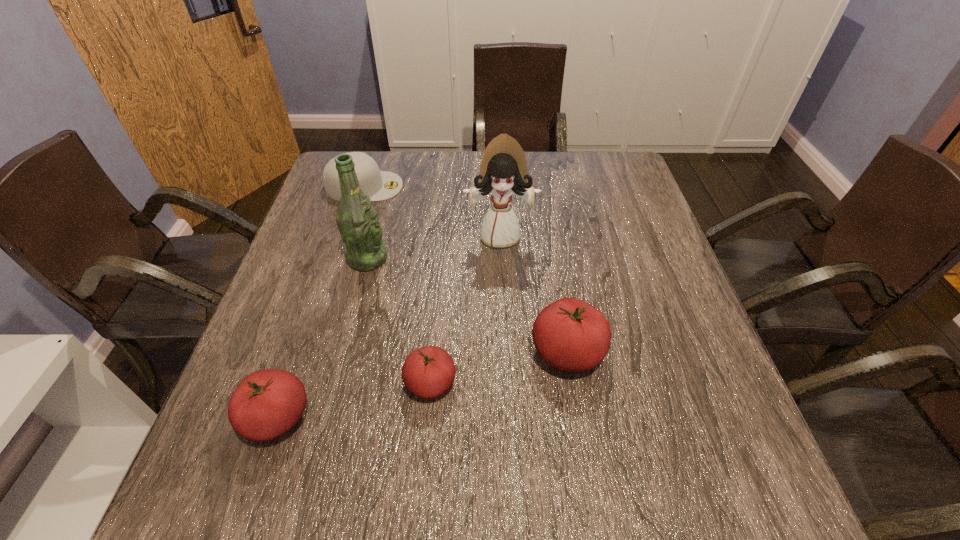
Please point a vacant point for placing a tomato on the right. Please provide its 2D coordinates. Your answer should be formatted as a tuple, i.e. [(x, y)], where the tuple contains the x and y coordinates of a point satisfying the conditions above.

[(689, 325)]